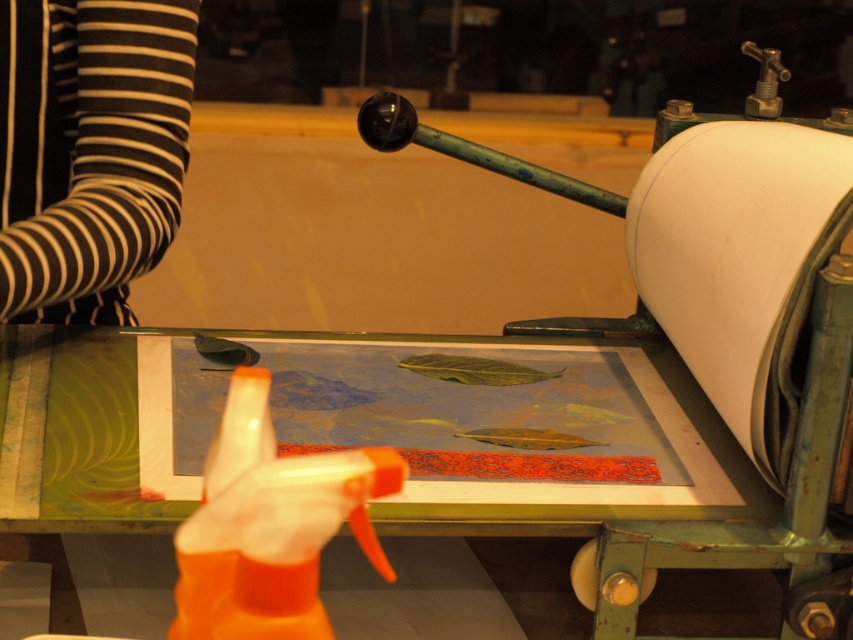
Question: Which object appears farthest from the camera in this image?

Choices:
 (A) black striped fabric at upper left
 (B) white paper at right

Answer: (A)

Question: Which point is farther to the camera?

Choices:
 (A) black striped fabric at upper left
 (B) white paper at right

Answer: (A)

Question: Can you confirm if black striped fabric at upper left is positioned to the right of white paper at right?

Choices:
 (A) no
 (B) yes

Answer: (A)

Question: Is black striped fabric at upper left thinner than white paper at right?

Choices:
 (A) yes
 (B) no

Answer: (B)

Question: Can you confirm if black striped fabric at upper left is bigger than white paper at right?

Choices:
 (A) yes
 (B) no

Answer: (B)